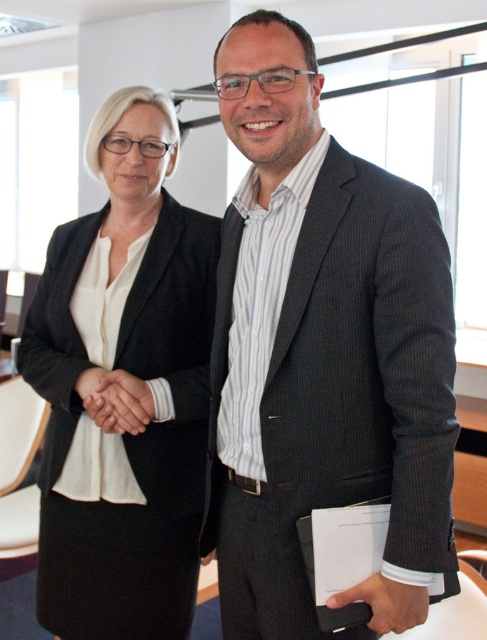
Is smooth skin handshake at center wider than black leather wallet at lower center?

Indeed, smooth skin handshake at center has a greater width compared to black leather wallet at lower center.

Can you confirm if smooth skin handshake at center is shorter than black leather wallet at lower center?

No.

Between point (141, 381) and point (344, 596), which one is positioned in front?

Positioned in front is point (344, 596).

The height and width of the screenshot is (640, 487). I want to click on smooth skin handshake at center, so click(115, 400).

Does point (163, 321) come farther from viewer compared to point (381, 632)?

That is True.

Can you confirm if matte black skirt at lower left is positioned to the left of black leather wallet at lower center?

Correct, you'll find matte black skirt at lower left to the left of black leather wallet at lower center.

You are a GUI agent. You are given a task and a screenshot of the screen. Output one action in this format:
    pyautogui.click(x=<x>, y=<y>)
    Task: Click on the matte black skirt at lower left
    This screenshot has height=640, width=487.
    Given the screenshot: What is the action you would take?
    pyautogui.click(x=128, y=372)

Which is behind, point (97, 220) or point (106, 381)?

Positioned behind is point (97, 220).

Does matte black skirt at lower left have a larger size compared to smooth skin handshake at center?

Yes.

Image resolution: width=487 pixels, height=640 pixels. What do you see at coordinates (128, 372) in the screenshot?
I see `matte black skirt at lower left` at bounding box center [128, 372].

At what (x,y) coordinates should I click in order to perform the action: click on matte black skirt at lower left. Please return your answer as a coordinate pair (x, y). Looking at the image, I should click on (128, 372).